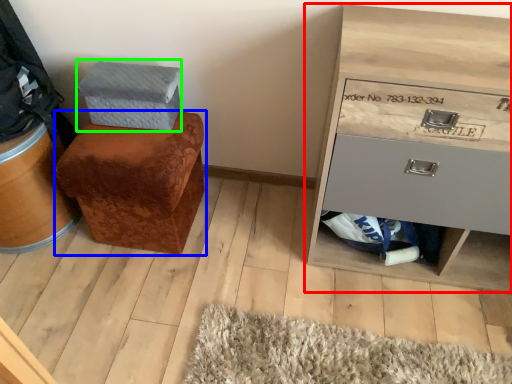
Question: Considering the real-world distances, which object is closest to chest of drawers (highlighted by a red box)? furniture (highlighted by a blue box) or shoe box (highlighted by a green box).

Choices:
 (A) furniture
 (B) shoe box

Answer: (A)